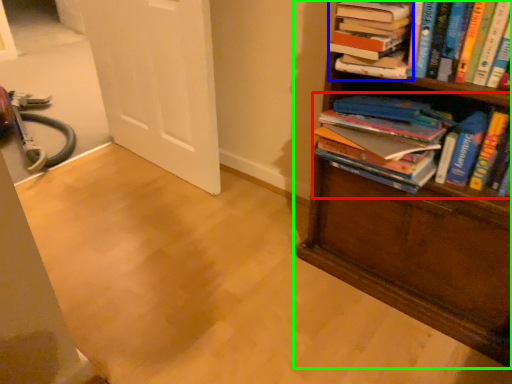
Question: Which is farther away from book (highlighted by a red box)? book (highlighted by a blue box) or bookcase (highlighted by a green box)?

Choices:
 (A) book
 (B) bookcase

Answer: (A)